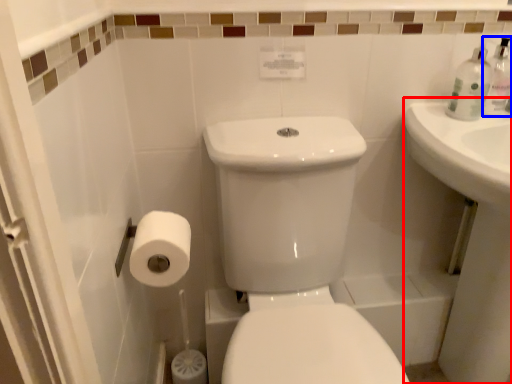
Question: Which of the following is the closest to the observer, counter top (highlighted by a red box) or soap dispenser (highlighted by a blue box)?

Choices:
 (A) counter top
 (B) soap dispenser

Answer: (A)